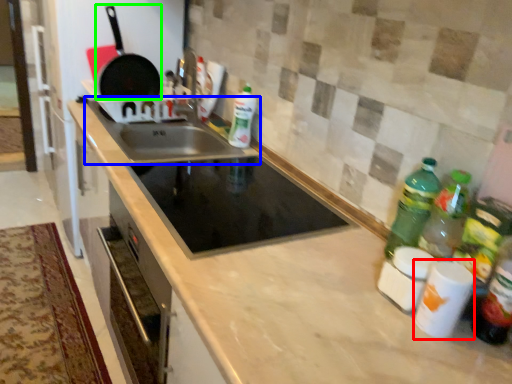
Question: Based on their relative distances, which object is nearer to appliance (highlighted by a red box)? Choose from sink (highlighted by a blue box) and frying pan (highlighted by a green box).

Choices:
 (A) sink
 (B) frying pan

Answer: (A)